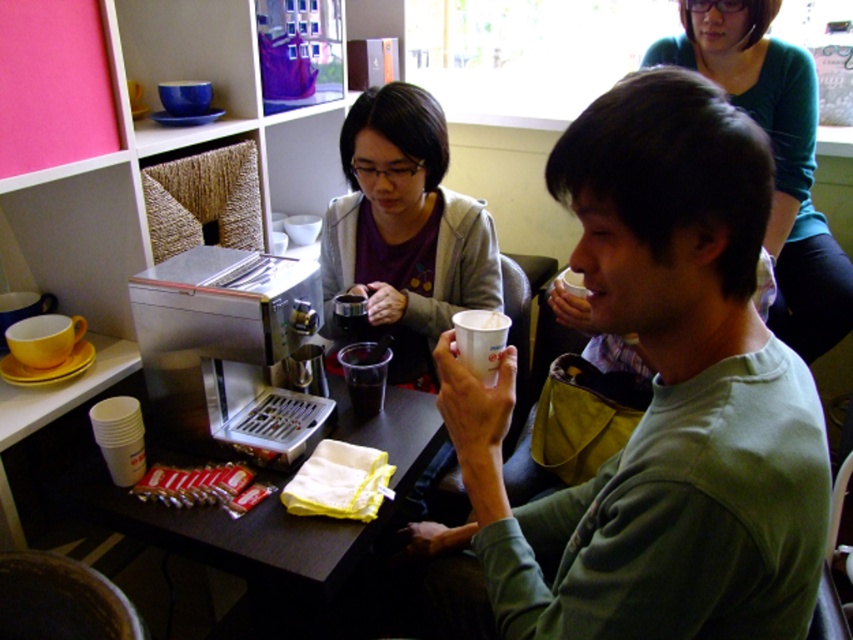
Can you confirm if green matte shirt at upper right is shorter than yellow matte cup at left?

Incorrect, green matte shirt at upper right's height does not fall short of yellow matte cup at left's.

In the scene shown: Can you confirm if green matte shirt at upper right is positioned above yellow matte cup at left?

Correct, green matte shirt at upper right is located above yellow matte cup at left.

This screenshot has height=640, width=853. Describe the element at coordinates (775, 157) in the screenshot. I see `green matte shirt at upper right` at that location.

You are a GUI agent. You are given a task and a screenshot of the screen. Output one action in this format:
    pyautogui.click(x=<x>, y=<y>)
    Task: Click on the green matte shirt at upper right
    The height and width of the screenshot is (640, 853).
    Given the screenshot: What is the action you would take?
    pyautogui.click(x=775, y=157)

Is point (268, 362) farther from camera compared to point (369, 259)?

No.

Is stainless steel coffee machine at lower left further to the viewer compared to matte black coffee pot at center?

No, stainless steel coffee machine at lower left is in front of matte black coffee pot at center.

Who is more forward, (x=216, y=332) or (x=421, y=184)?

Point (x=216, y=332)

Locate an element on the screen. The width and height of the screenshot is (853, 640). stainless steel coffee machine at lower left is located at coordinates (230, 352).

This screenshot has width=853, height=640. What do you see at coordinates (230, 352) in the screenshot?
I see `stainless steel coffee machine at lower left` at bounding box center [230, 352].

Who is more distant from viewer, [274,374] or [64,406]?

Positioned behind is point [274,374].

What do you see at coordinates (230, 352) in the screenshot? This screenshot has height=640, width=853. I see `stainless steel coffee machine at lower left` at bounding box center [230, 352].

Where is `stainless steel coffee machine at lower left`? stainless steel coffee machine at lower left is located at coordinates (230, 352).